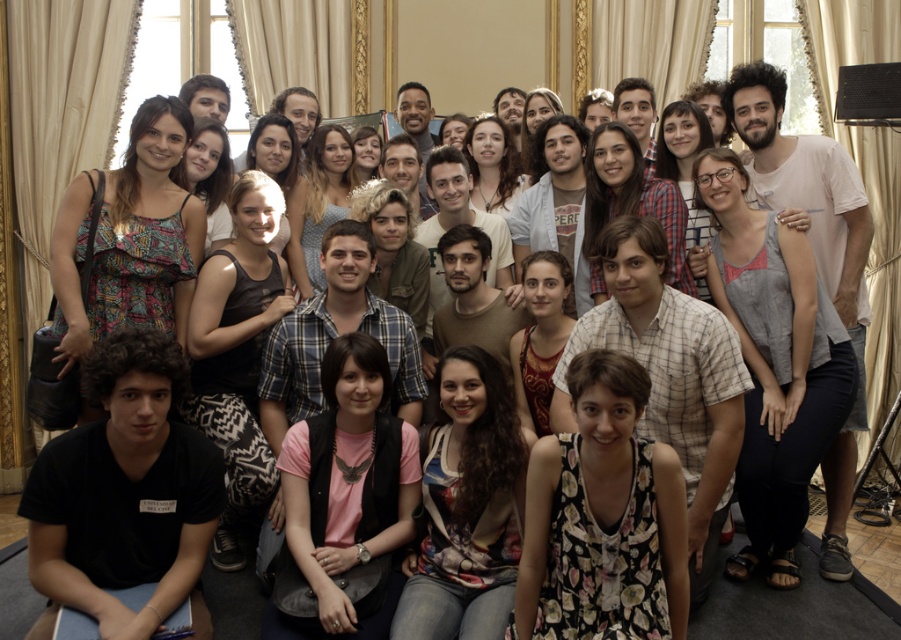
You are standing in the grand room with ornate gold trimmed curtains in the background. You see a point marked at coordinate (x=602, y=518). What object is this point located on?

The point at coordinate (x=602, y=518) is located on the floral print dress at center.